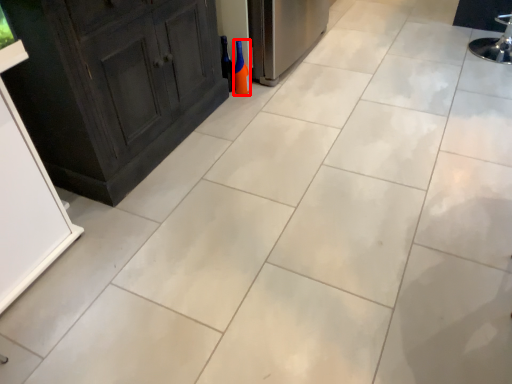
Question: From the image's perspective, considering the relative positions of bottle (annotated by the red box) and wine bottle in the image provided, where is bottle (annotated by the red box) located with respect to the staircase?

Choices:
 (A) below
 (B) above

Answer: (A)